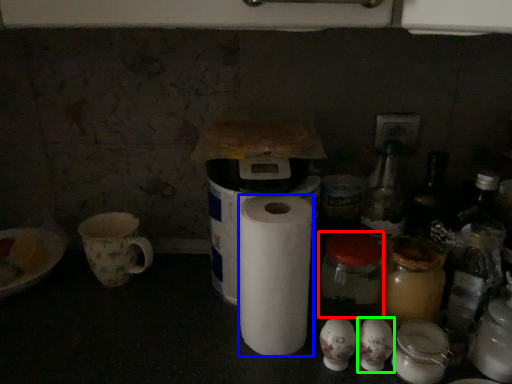
Question: Estimate the real-world distances between objects in this image. Which object is farther from glass jar (highlighted by a red box), paper towel (highlighted by a blue box) or toilet paper (highlighted by a green box)?

Choices:
 (A) paper towel
 (B) toilet paper

Answer: (A)